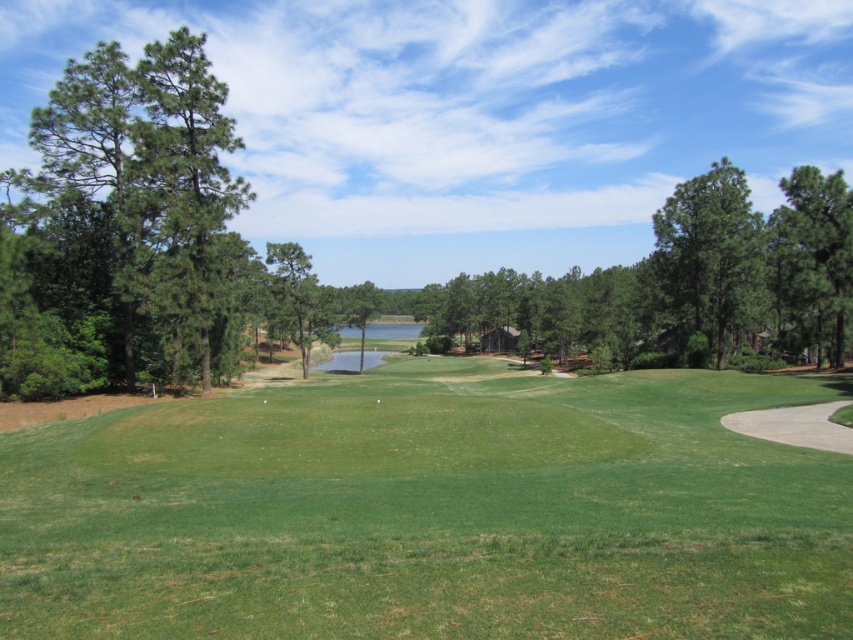
Question: Which point is farther from the camera taking this photo?

Choices:
 (A) (814, 320)
 (B) (282, 244)
 (C) (689, 196)

Answer: (B)

Question: Is green grassy field at center bigger than green matte tree at right?

Choices:
 (A) yes
 (B) no

Answer: (B)

Question: Which object appears closest to the camera in this image?

Choices:
 (A) green matte tree at right
 (B) green grassy field at center
 (C) green matte tree at center

Answer: (B)

Question: Is green grassy field at center bigger than green matte tree at center?

Choices:
 (A) yes
 (B) no

Answer: (B)

Question: Which is farther from the green leafy tree at center?

Choices:
 (A) green grassy field at center
 (B) green matte tree at upper right

Answer: (B)

Question: Can you confirm if green matte tree at upper right is positioned below green matte tree at center?

Choices:
 (A) yes
 (B) no

Answer: (B)